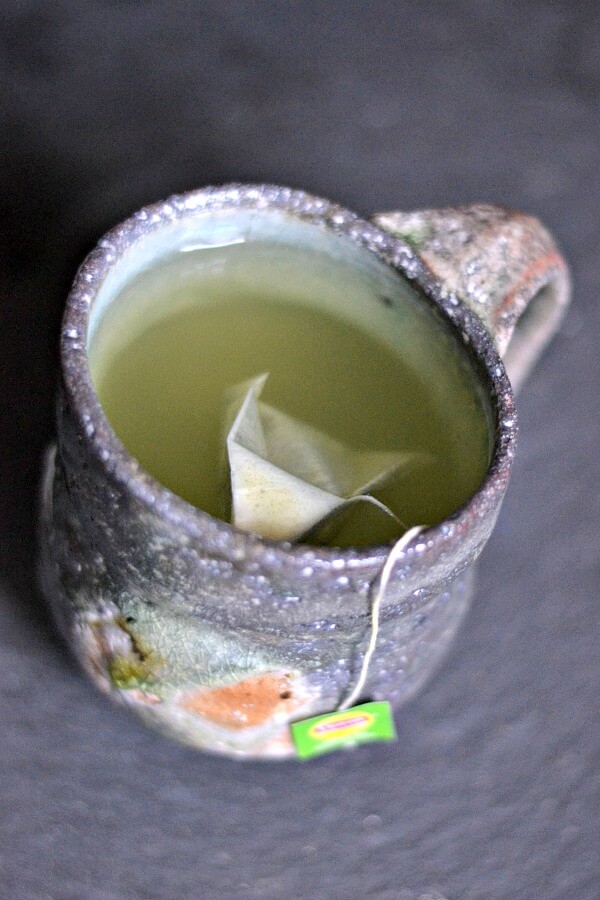
Where is `teabag tag`? The width and height of the screenshot is (600, 900). teabag tag is located at coordinates click(x=335, y=730).